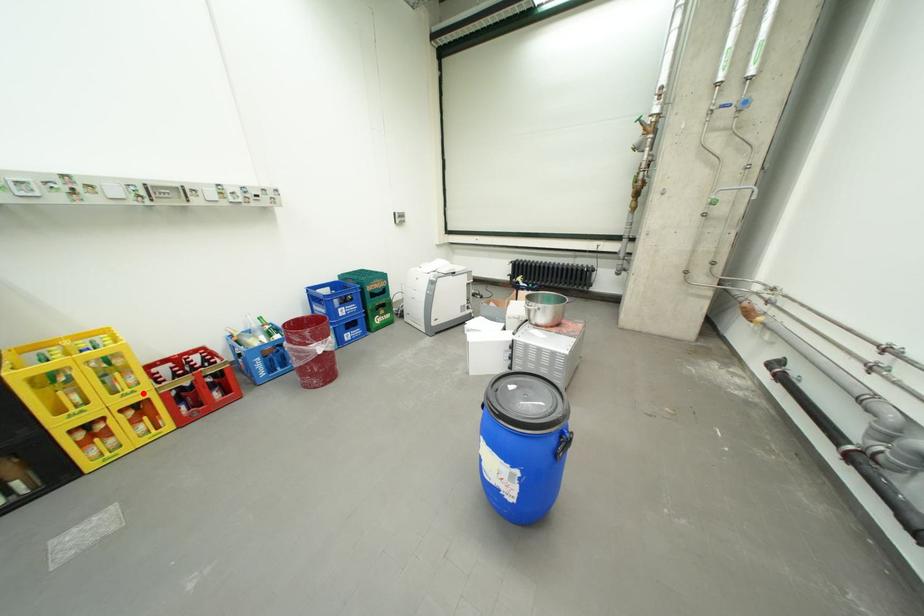
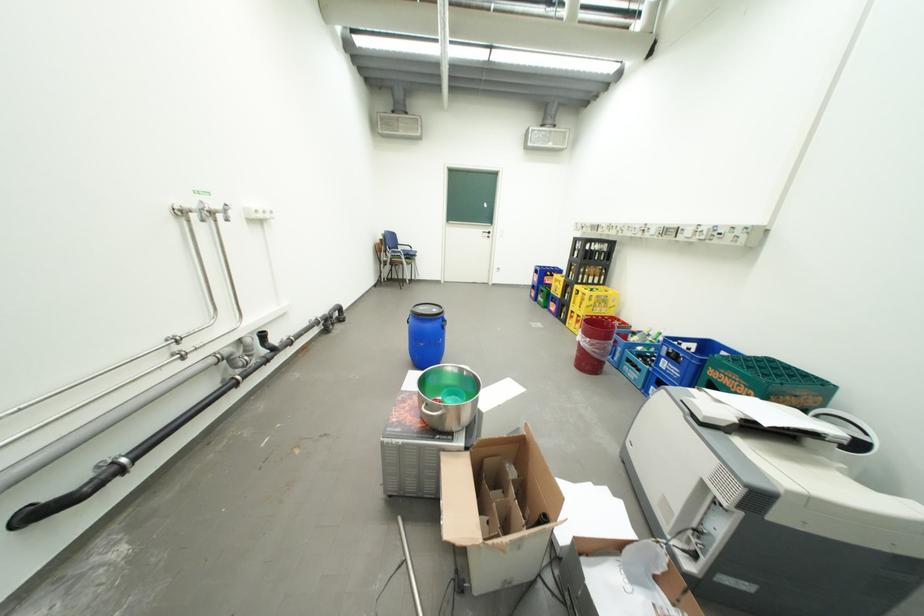
Question: I am providing you with two images of the same scene from different viewpoints. Image1 has a red point marked. In image2, the corresponding 3D location appears at what relative position? Reply with the corresponding letter.

Choices:
 (A) Closer
 (B) Farther

Answer: (A)